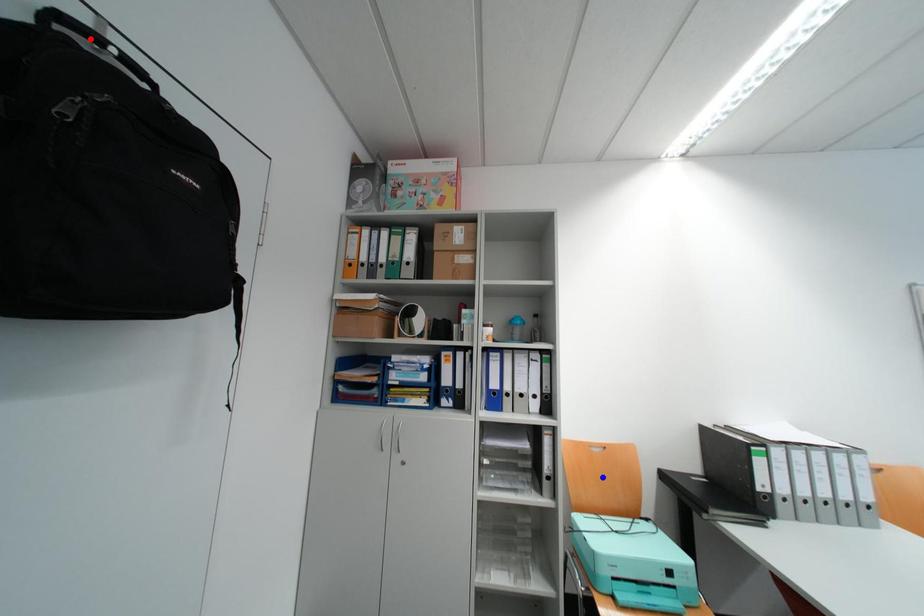
Question: Two points are marked on the image. Which point is closer to the camera?

Choices:
 (A) Blue point is closer.
 (B) Red point is closer.

Answer: (B)